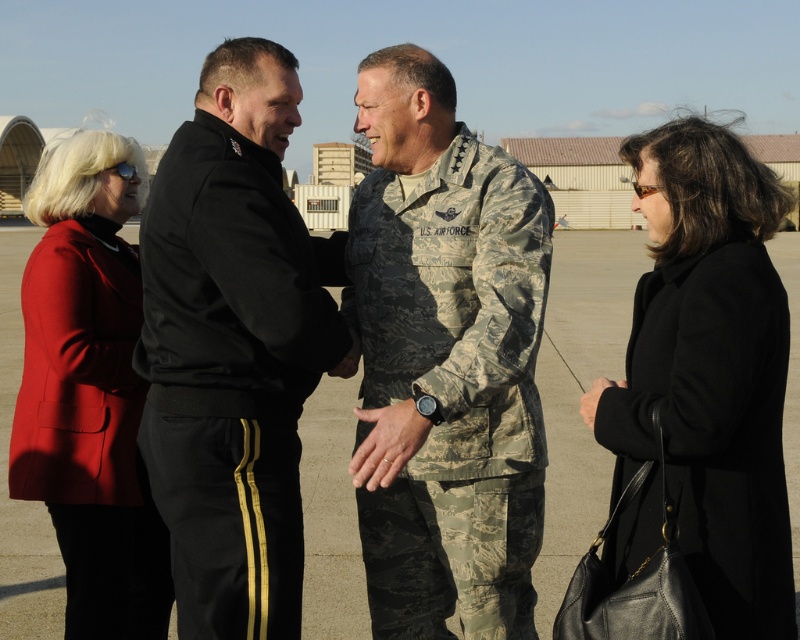
Between point (525, 579) and point (300, 397), which one is positioned in front?

Point (300, 397) is in front.

Which is below, camouflage uniform at center or black matte uniform at center?

camouflage uniform at center is below.

Measure the distance between camouflage uniform at center and camera.

camouflage uniform at center is 11.42 feet from camera.

Find the location of a particular element. This screenshot has width=800, height=640. camouflage uniform at center is located at coordinates (444, 360).

Who is higher up, camouflage uniform at center or black leather coat at lower right?

Positioned higher is black leather coat at lower right.

Is camouflage uniform at center to the right of black leather coat at lower right from the viewer's perspective?

Incorrect, camouflage uniform at center is not on the right side of black leather coat at lower right.

Which is behind, point (482, 456) or point (704, 225)?

The point (482, 456) is more distant.

Where is `camouflage uniform at center`? The height and width of the screenshot is (640, 800). camouflage uniform at center is located at coordinates (444, 360).

Is black matte uniform at center thinner than black leather coat at lower right?

No.

Between black matte uniform at center and black leather coat at lower right, which one appears on the right side from the viewer's perspective?

black leather coat at lower right is more to the right.

Is point (296, 330) positioned after point (700, 289)?

That is True.

Where is `black matte uniform at center`? This screenshot has height=640, width=800. black matte uniform at center is located at coordinates (233, 346).